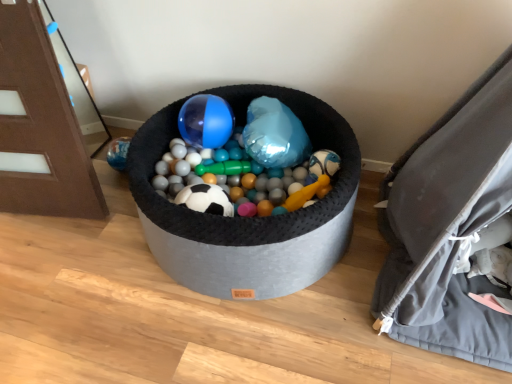
Question: Is brushed wood door at left wider than translucent plastic ball at center?

Choices:
 (A) no
 (B) yes

Answer: (A)

Question: Is brushed wood door at left completely or partially outside of translucent plastic ball at center?

Choices:
 (A) no
 (B) yes

Answer: (B)

Question: Is brushed wood door at left smaller than translucent plastic ball at center?

Choices:
 (A) yes
 (B) no

Answer: (A)

Question: Can you confirm if brushed wood door at left is taller than translucent plastic ball at center?

Choices:
 (A) yes
 (B) no

Answer: (A)

Question: Considering the relative sizes of brushed wood door at left and translucent plastic ball at center in the image provided, is brushed wood door at left bigger than translucent plastic ball at center?

Choices:
 (A) no
 (B) yes

Answer: (A)

Question: In terms of size, does translucent plastic ball at center appear bigger or smaller than brushed wood door at left?

Choices:
 (A) small
 (B) big

Answer: (B)

Question: Relative to brushed wood door at left, is translucent plastic ball at center in front or behind?

Choices:
 (A) behind
 (B) front

Answer: (A)

Question: From the image's perspective, relative to brushed wood door at left, is translucent plastic ball at center above or below?

Choices:
 (A) above
 (B) below

Answer: (B)

Question: From their relative heights in the image, would you say translucent plastic ball at center is taller or shorter than brushed wood door at left?

Choices:
 (A) short
 (B) tall

Answer: (A)

Question: Relative to translucent plastic ball at center, is brushed wood door at left in front or behind?

Choices:
 (A) behind
 (B) front

Answer: (B)

Question: In terms of size, does brushed wood door at left appear bigger or smaller than translucent plastic ball at center?

Choices:
 (A) small
 (B) big

Answer: (A)

Question: Is brushed wood door at left taller or shorter than translucent plastic ball at center?

Choices:
 (A) tall
 (B) short

Answer: (A)

Question: Which is correct: brushed wood door at left is inside translucent plastic ball at center, or outside of it?

Choices:
 (A) outside
 (B) inside

Answer: (A)

Question: From the image's perspective, relative to gray fabric bean bag chair at right, is translucent plastic ball at center above or below?

Choices:
 (A) above
 (B) below

Answer: (B)

Question: Is translucent plastic ball at center to the left or to the right of gray fabric bean bag chair at right in the image?

Choices:
 (A) right
 (B) left

Answer: (B)